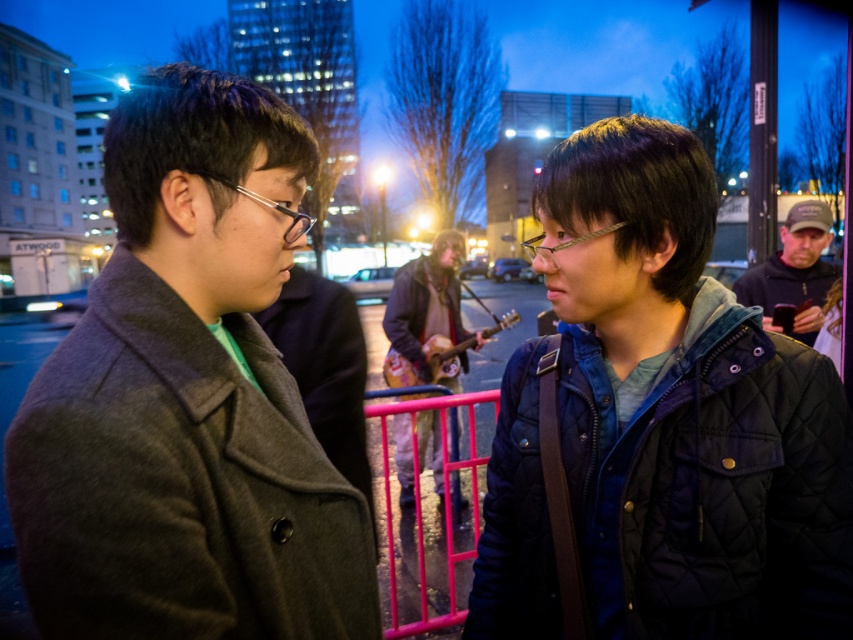
Question: Does gray wool coat at left have a larger size compared to camouflage-patterned jacket at center?

Choices:
 (A) yes
 (B) no

Answer: (B)

Question: Is gray wool coat at left above dark blue quilted jacket at right?

Choices:
 (A) yes
 (B) no

Answer: (B)

Question: Estimate the real-world distances between objects in this image. Which object is closer to the dark blue quilted jacket at right?

Choices:
 (A) gray wool coat at left
 (B) camouflage-patterned jacket at center

Answer: (B)

Question: Which point is closer to the camera?

Choices:
 (A) (141, 428)
 (B) (602, 481)
 (C) (804, 310)

Answer: (A)

Question: Which object appears farthest from the camera in this image?

Choices:
 (A) gray wool coat at left
 (B) dark blue quilted jacket at right
 (C) camouflage-patterned jacket at center

Answer: (C)

Question: Is quilted dark blue jacket at center thinner than camouflage-patterned jacket at center?

Choices:
 (A) no
 (B) yes

Answer: (B)